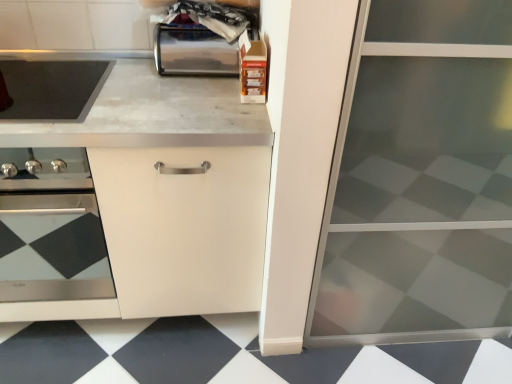
At what (x,y) coordinates should I click in order to perform the action: click on blank space situated above shiny metallic toaster at upper center (from a real-world perspective). Please return your answer as a coordinate pair (x, y). This screenshot has width=512, height=384. Looking at the image, I should click on (201, 17).